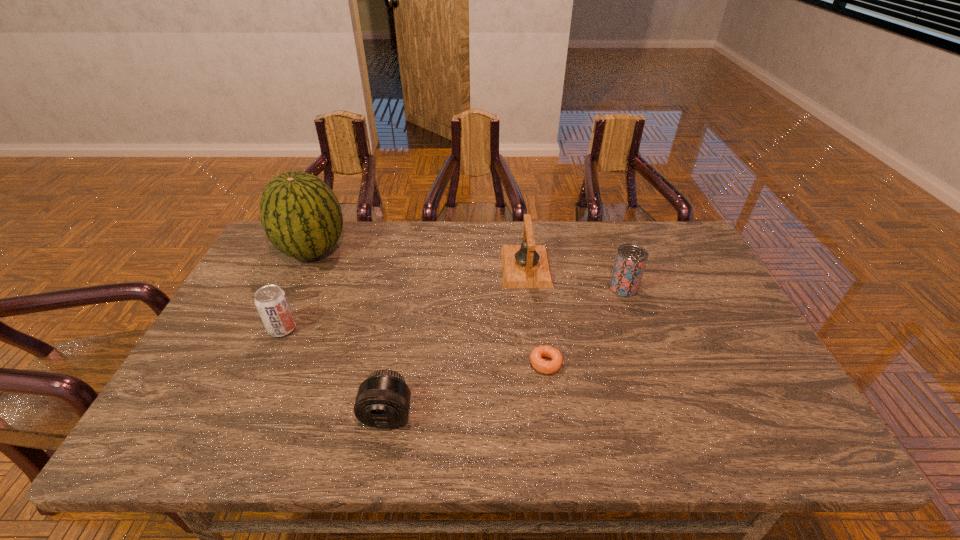
Where is `vacant space situated 0.070m on the right of the beer can`? This screenshot has height=540, width=960. vacant space situated 0.070m on the right of the beer can is located at coordinates (661, 287).

Locate an element on the screen. This screenshot has width=960, height=540. free spot located 0.320m on the back of the fourth farthest object is located at coordinates (319, 248).

Where is `vacant space located on the right of the fifth farthest object`? This screenshot has height=540, width=960. vacant space located on the right of the fifth farthest object is located at coordinates (582, 363).

Identify the location of watermelon that is at the far edge. (301, 216).

You are a GUI agent. You are given a task and a screenshot of the screen. Output one action in this format:
    pyautogui.click(x=<x>, y=<y>)
    Task: Click on the bell located in the far edge section of the desktop
    Image resolution: width=960 pixels, height=540 pixels.
    Given the screenshot: What is the action you would take?
    pyautogui.click(x=527, y=265)

This screenshot has width=960, height=540. What are the coordinates of `object situated at the near edge` in the screenshot? It's located at (383, 400).

Where is `watermelon that is at the left edge`? watermelon that is at the left edge is located at coordinates (301, 216).

This screenshot has width=960, height=540. What are the coordinates of `soda can located in the left edge section of the desktop` in the screenshot? It's located at (271, 301).

Find the location of a particular element. This screenshot has height=540, width=960. object located at the far left corner is located at coordinates (301, 216).

The image size is (960, 540). What are the coordinates of `blank space at the far edge` in the screenshot? It's located at (420, 221).